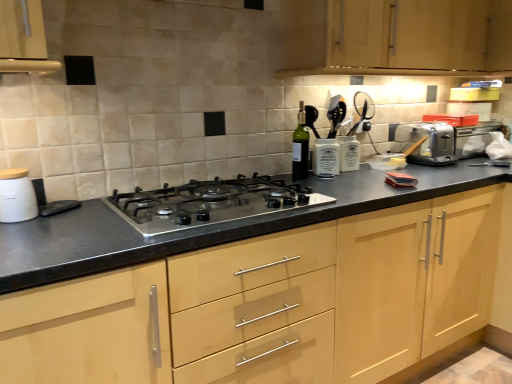
The height and width of the screenshot is (384, 512). I want to click on silver metallic toaster at right, so point(426,143).

In order to click on green glass bottle at center in this screenshot , I will do `click(300, 147)`.

Can you confirm if green glass bottle at center is wider than light wood cabinet at center, which is the second cabinetry in top-to-bottom order?

In fact, green glass bottle at center might be narrower than light wood cabinet at center, which is the second cabinetry in top-to-bottom order.

Between green glass bottle at center and light wood cabinet at center, which is the second cabinetry in top-to-bottom order, which one has more height?

light wood cabinet at center, which is the second cabinetry in top-to-bottom order, is taller.

From the image's perspective, is green glass bottle at center positioned above or below light wood cabinet at center, which is the second cabinetry in top-to-bottom order?

green glass bottle at center is above light wood cabinet at center, which is the second cabinetry in top-to-bottom order.

Is green glass bottle at center completely or partially outside of light wood cabinet at center, which is the second cabinetry in top-to-bottom order?

Yes, green glass bottle at center is outside of light wood cabinet at center, which is the second cabinetry in top-to-bottom order.

In the scene shown: Considering the sizes of satin black gas stove at center and green glass bottle at center in the image, is satin black gas stove at center wider or thinner than green glass bottle at center?

Result: satin black gas stove at center is wider than green glass bottle at center.

Locate an element on the screen. The height and width of the screenshot is (384, 512). gas stove lying below the green glass bottle at center (from the image's perspective) is located at coordinates (210, 202).

From a real-world perspective, is satin black gas stove at center located beneath green glass bottle at center?

Indeed, from a real-world perspective, satin black gas stove at center is positioned beneath green glass bottle at center.

Is green glass bottle at center positioned with its back to white matte canister at left?

green glass bottle at center is not turned away from white matte canister at left.

From the picture: Is green glass bottle at center not near white matte canister at left?

Yes, green glass bottle at center and white matte canister at left are quite far apart.

From a real-world perspective, relative to white matte canister at left, is green glass bottle at center vertically above or below?

green glass bottle at center is above white matte canister at left.

From the image's perspective, is green glass bottle at center under white matte canister at left?

Incorrect, from the image's perspective, green glass bottle at center is higher than white matte canister at left.

Is satin black gas stove at center in contact with light wood cabinet at upper center, the first cabinetry positioned from the top?

They are not placed beside each other.

Which of these two, satin black gas stove at center or light wood cabinet at upper center, which is the 2th cabinetry from bottom to top, is bigger?

light wood cabinet at upper center, which is the 2th cabinetry from bottom to top.

Could you tell me if satin black gas stove at center is turned towards light wood cabinet at upper center, the first cabinetry positioned from the top?

No, satin black gas stove at center is not turned towards light wood cabinet at upper center, the first cabinetry positioned from the top.

Who is shorter, satin black gas stove at center or light wood cabinet at upper center, which is the 2th cabinetry from bottom to top?

Standing shorter between the two is satin black gas stove at center.

Can you tell me how much light wood cabinet at center, which is the second cabinetry in top-to-bottom order, and green glass bottle at center differ in facing direction?

The angular difference between light wood cabinet at center, which is the second cabinetry in top-to-bottom order, and green glass bottle at center is 0.791 degrees.

Find the location of `bottle above the light wood cabinet at center, the first cabinetry when ordered from bottom to top (from the image's perspective)`. bottle above the light wood cabinet at center, the first cabinetry when ordered from bottom to top (from the image's perspective) is located at coordinates (300, 147).

Is light wood cabinet at center, the first cabinetry when ordered from bottom to top, at the left side of green glass bottle at center?

Incorrect, light wood cabinet at center, the first cabinetry when ordered from bottom to top, is not on the left side of green glass bottle at center.

Is light wood cabinet at center, the first cabinetry when ordered from bottom to top, turned away from green glass bottle at center?

No, green glass bottle at center is not at the back of light wood cabinet at center, the first cabinetry when ordered from bottom to top.

From the image's perspective, would you say white matte canister at left is positioned over satin black gas stove at center?

Yes.

From a real-world perspective, is white matte canister at left beneath satin black gas stove at center?

No, from a real-world perspective, white matte canister at left is not below satin black gas stove at center.

Can you confirm if white matte canister at left is thinner than satin black gas stove at center?

Yes, white matte canister at left is thinner than satin black gas stove at center.

Are silver metallic toaster at right and light wood cabinet at center, the first cabinetry when ordered from bottom to top, beside each other?

No, silver metallic toaster at right is not beside light wood cabinet at center, the first cabinetry when ordered from bottom to top.

Is light wood cabinet at center, the first cabinetry when ordered from bottom to top, inside silver metallic toaster at right?

No, light wood cabinet at center, the first cabinetry when ordered from bottom to top, is located outside of silver metallic toaster at right.

Where is `toaster on the right of the light wood cabinet at center, the first cabinetry when ordered from bottom to top`? The image size is (512, 384). toaster on the right of the light wood cabinet at center, the first cabinetry when ordered from bottom to top is located at coordinates (426, 143).

This screenshot has height=384, width=512. What are the coordinates of `cabinetry below the green glass bottle at center (from a real-world perspective)` in the screenshot? It's located at (271, 304).

Where is `gas stove that is on the left side of green glass bottle at center`? The image size is (512, 384). gas stove that is on the left side of green glass bottle at center is located at coordinates (210, 202).

Looking at the image, which one is located closer to light wood cabinet at center, the first cabinetry when ordered from bottom to top, silver metallic toaster at right or green glass bottle at center?

green glass bottle at center is positioned closer to the anchor light wood cabinet at center, the first cabinetry when ordered from bottom to top.

From the image, which object appears to be nearer to light wood cabinet at center, the first cabinetry when ordered from bottom to top, satin black gas stove at center or silver metallic toaster at right?

Based on the image, satin black gas stove at center appears to be nearer to light wood cabinet at center, the first cabinetry when ordered from bottom to top.

Considering their positions, is satin black gas stove at center positioned further to white matte canister at left than light wood cabinet at upper center, which is the 2th cabinetry from bottom to top?

light wood cabinet at upper center, which is the 2th cabinetry from bottom to top.

Considering their positions, is white matte canister at left positioned further to satin black gas stove at center than light wood cabinet at upper center, which is the 2th cabinetry from bottom to top?

The object further to satin black gas stove at center is light wood cabinet at upper center, which is the 2th cabinetry from bottom to top.

Which object lies nearer to the anchor point satin black gas stove at center, green glass bottle at center or white matte canister at left?

green glass bottle at center.

Consider the image. Which object lies further to the anchor point silver metallic toaster at right, satin black gas stove at center or light wood cabinet at center, which is the second cabinetry in top-to-bottom order?

Based on the image, satin black gas stove at center appears to be further to silver metallic toaster at right.

When comparing their distances from white matte canister at left, does silver metallic toaster at right or green glass bottle at center seem further?

The object further to white matte canister at left is silver metallic toaster at right.

Estimate the real-world distances between objects in this image. Which object is closer to silver metallic toaster at right, satin black gas stove at center or white matte canister at left?

satin black gas stove at center lies closer to silver metallic toaster at right than the other object.

This screenshot has height=384, width=512. I want to click on cabinetry located between light wood cabinet at center, which is the second cabinetry in top-to-bottom order, and silver metallic toaster at right in the depth direction, so click(399, 37).

Where is `gas stove between light wood cabinet at upper center, the first cabinetry positioned from the top, and light wood cabinet at center, the first cabinetry when ordered from bottom to top, from top to bottom`? The image size is (512, 384). gas stove between light wood cabinet at upper center, the first cabinetry positioned from the top, and light wood cabinet at center, the first cabinetry when ordered from bottom to top, from top to bottom is located at coordinates [210, 202].

The width and height of the screenshot is (512, 384). Identify the location of gas stove positioned between light wood cabinet at center, the first cabinetry when ordered from bottom to top, and silver metallic toaster at right from near to far. (210, 202).

Identify the location of gas stove between white matte canister at left and green glass bottle at center in the horizontal direction. This screenshot has height=384, width=512. [x=210, y=202].